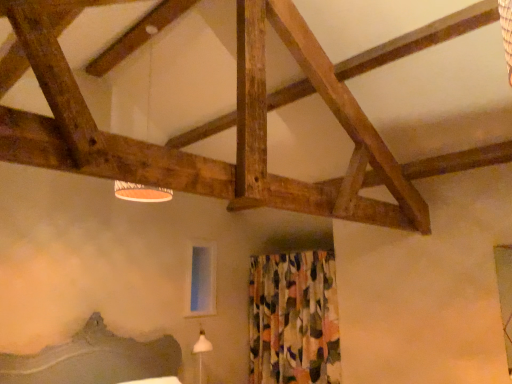
Question: Relative to transparent glass window screen at center, is white fabric lampshade at upper center in front or behind?

Choices:
 (A) behind
 (B) front

Answer: (B)

Question: From their relative heights in the image, would you say white fabric lampshade at upper center is taller or shorter than transparent glass window screen at center?

Choices:
 (A) tall
 (B) short

Answer: (A)

Question: Which is nearer to the transparent glass window screen at center?

Choices:
 (A) floral fabric curtain at center
 (B) white fabric lampshade at upper center

Answer: (A)

Question: Which of these objects is positioned closest to the floral fabric curtain at center?

Choices:
 (A) transparent glass window screen at center
 (B) white fabric lampshade at upper center

Answer: (A)